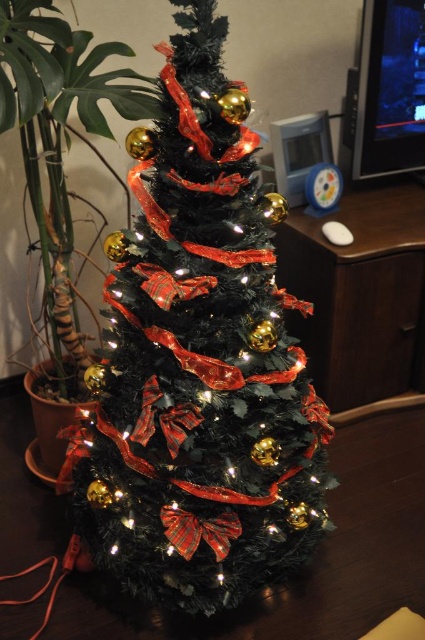
Question: Which object is farther from the camera taking this photo?

Choices:
 (A) brown wood table at right
 (B) shiny green christmas tree at center

Answer: (A)

Question: Does shiny green christmas tree at center have a smaller size compared to brown wood table at right?

Choices:
 (A) no
 (B) yes

Answer: (A)

Question: Is the position of shiny green christmas tree at center less distant than that of brown wood table at right?

Choices:
 (A) yes
 (B) no

Answer: (A)

Question: Can you confirm if shiny green christmas tree at center is positioned to the left of brown wood table at right?

Choices:
 (A) no
 (B) yes

Answer: (B)

Question: Which of the following is the closest to the observer?

Choices:
 (A) (283, 349)
 (B) (419, 275)

Answer: (A)